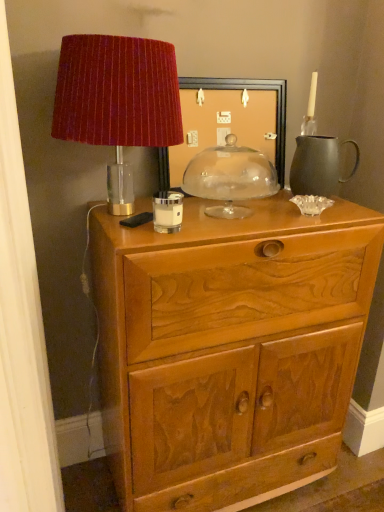
I want to click on free space to the right of velvet red lampshade at upper left, so click(235, 217).